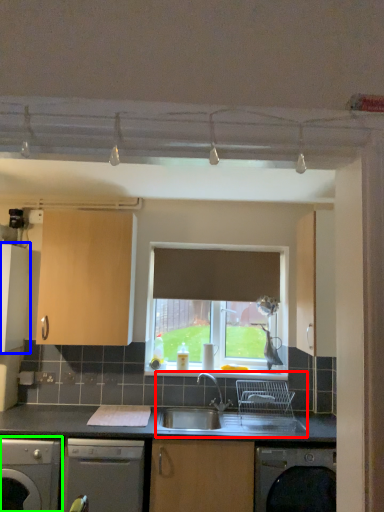
Question: Which object is the closest to the sink (highlighted by a red box)? Choose among these: cabinetry (highlighted by a blue box) or dishwasher (highlighted by a green box).

Choices:
 (A) cabinetry
 (B) dishwasher

Answer: (B)